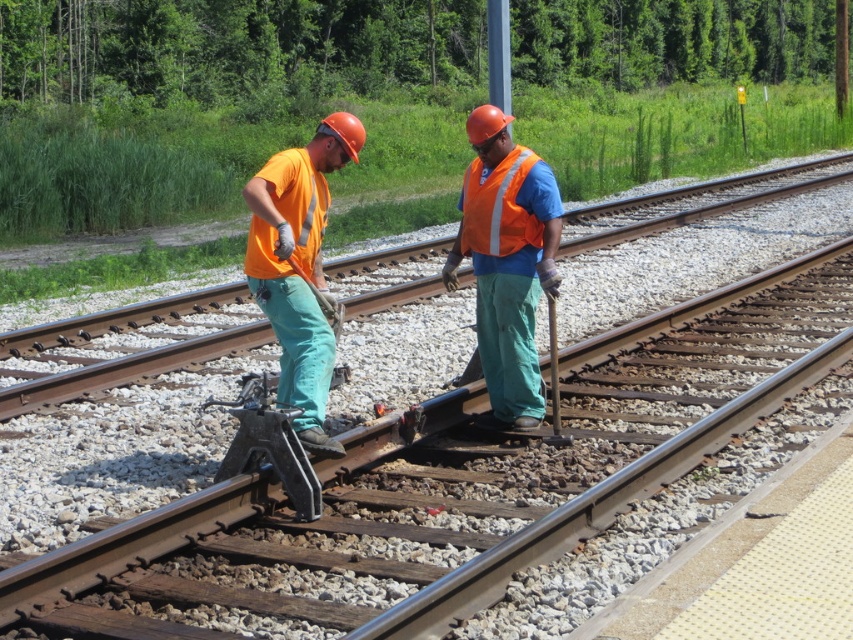
Question: Which is nearer to the reflective orange safety vest at center?

Choices:
 (A) matte orange shirt at center
 (B) orange reflective vest at center

Answer: (B)

Question: Which of the following is the closest to the observer?

Choices:
 (A) (250, 230)
 (B) (495, 385)

Answer: (A)

Question: Is orange reflective vest at center closer to camera compared to matte orange shirt at center?

Choices:
 (A) no
 (B) yes

Answer: (A)

Question: Does orange reflective vest at center have a smaller size compared to matte orange shirt at center?

Choices:
 (A) yes
 (B) no

Answer: (B)

Question: Is matte orange shirt at center below reflective orange safety vest at center?

Choices:
 (A) no
 (B) yes

Answer: (B)

Question: Which point is closer to the camera?

Choices:
 (A) (509, 157)
 (B) (314, 211)

Answer: (B)